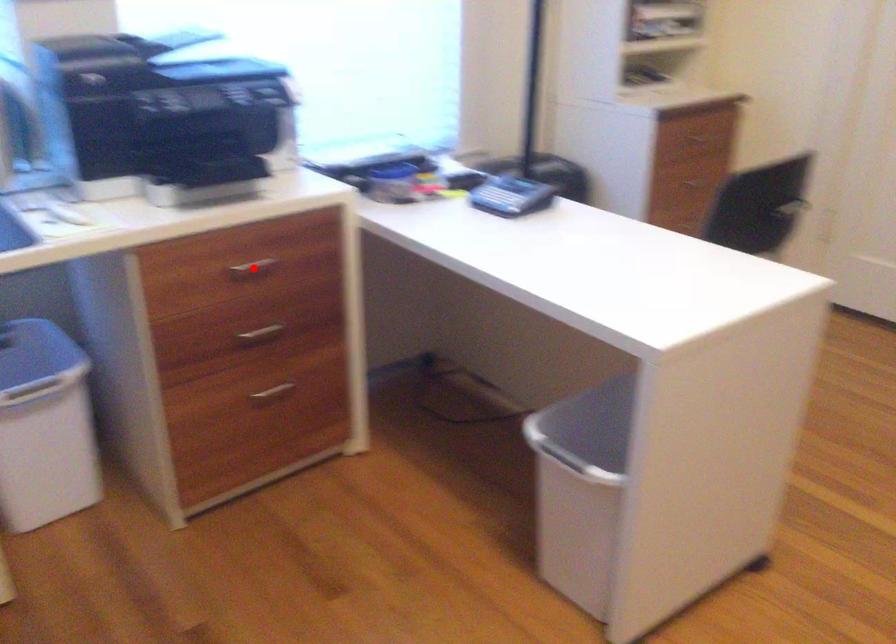
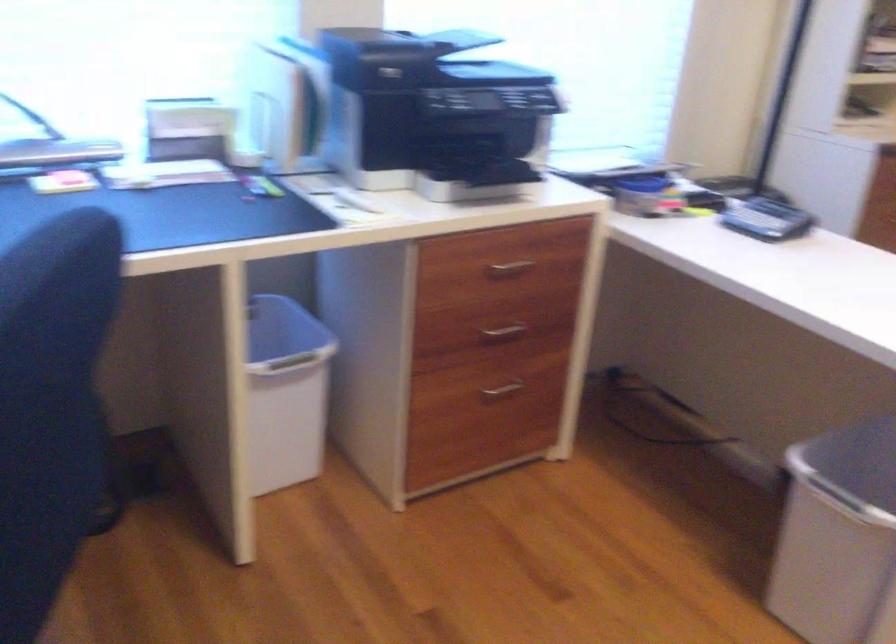
The point at the highlighted location is marked in the first image. Where is the corresponding point in the second image?

(510, 268)